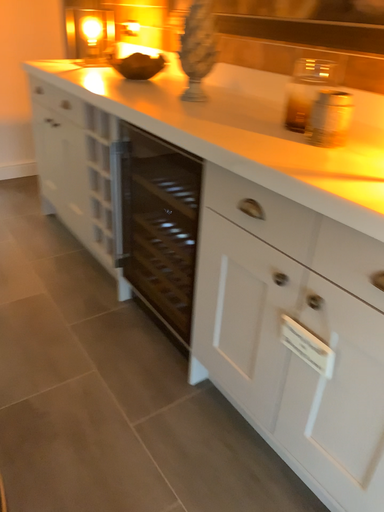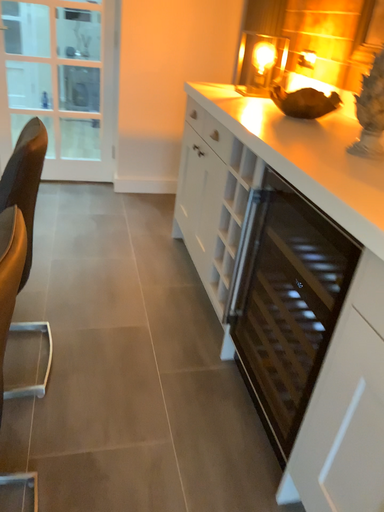
Question: Which way did the camera rotate in the video?

Choices:
 (A) rotated left
 (B) rotated right

Answer: (A)